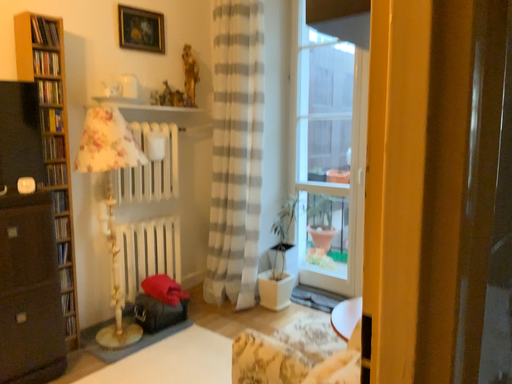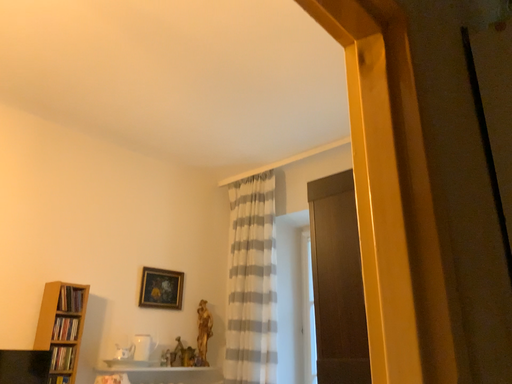
Question: How did the camera likely rotate when shooting the video?

Choices:
 (A) rotated downward
 (B) rotated upward

Answer: (B)